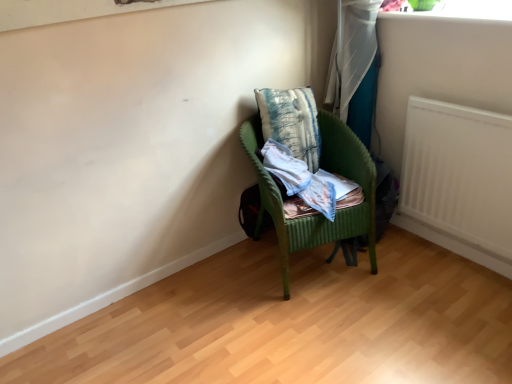
At what (x,y) coordinates should I click in order to perform the action: click on vacant area that lies in front of green wicker chair at center. Please return your answer as a coordinate pair (x, y). Looking at the image, I should click on (330, 325).